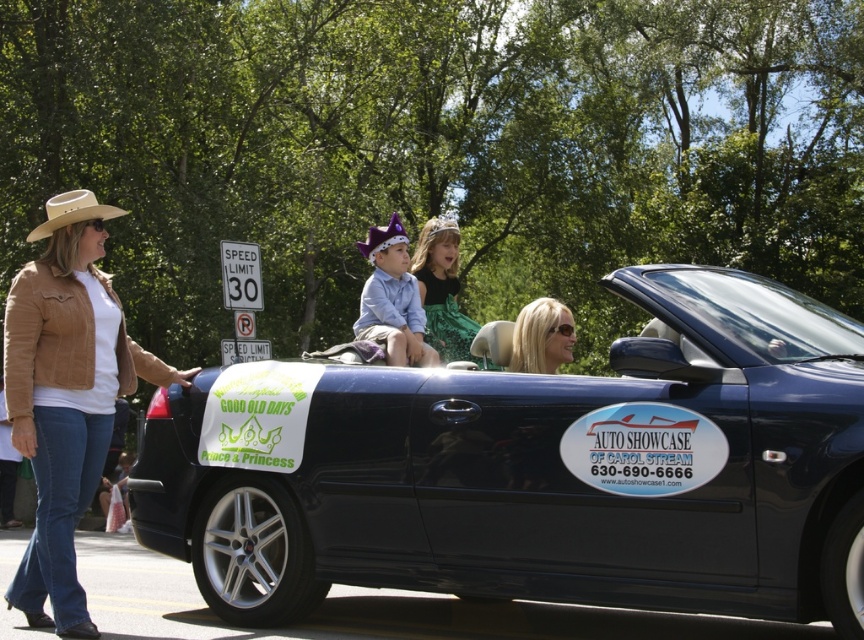
You are a photographer standing at the camera position. You want to capture a closeup shot of the tan leather jacket at left without moving the camera. Is it possible to do so with a standard 50mm lens?

The tan leather jacket at left is 15.75 feet from camera. A standard 50mm lens has a focal length that captures a field of view similar to human vision, so at 15.75 feet distance, it would be challenging to get a closeup without moving closer or using a telephoto lens. Therefore, it is not possible with a standard 50mm lens.

You are a costume designer preparing for a parade. You have two items to display on a mannequin stand. The tan leather jacket at left and the green satin dress at center. Which item requires a larger mannequin to fit properly?

The tan leather jacket at left requires a larger mannequin because it has a larger size compared to the green satin dress at center.